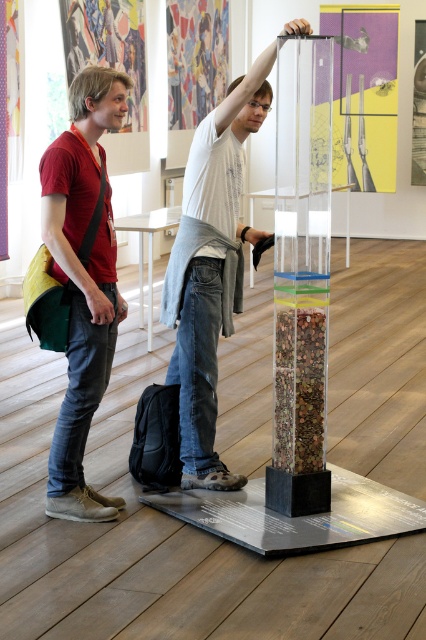
You are standing in the art gallery and see the white matte shirt at center and the matte red shirt at left. Which person is standing more to your right?

The white matte shirt at center is more to the right because it is positioned on the right side of the matte red shirt at left.

You are standing at the entrance of the art gallery and want to reach the transparent acrylic tube at center. According to the coordinates provided, in which direction should you move from your current position to reach it?

The transparent acrylic tube at center is located at coordinates point [301,276]. Since you are at the entrance, you should move towards the center of the gallery to reach it.

Based on the photo, you are a photographer setting up a tripod in the art gallery. You want to ensure both the white matte shirt at center and the matte red shirt at left are visible in your shot. Given their heights, which person should you focus on first to frame the shot properly?

The white matte shirt at center is taller than the matte red shirt at left, so you should focus on the white matte shirt at center first to ensure it is properly framed in the shot.